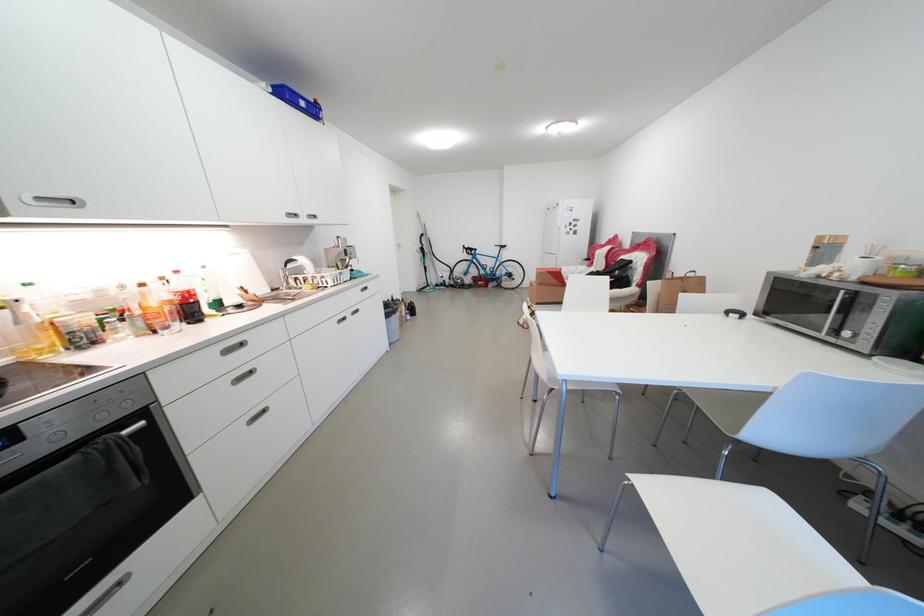
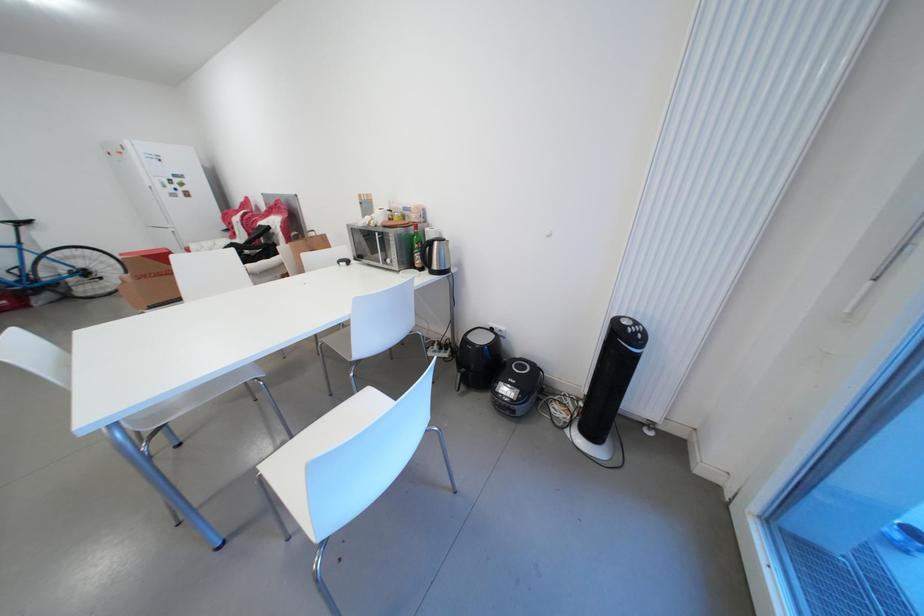
Based on the continuous images, in which direction is the camera rotating?

The camera's rotation is toward right-down.